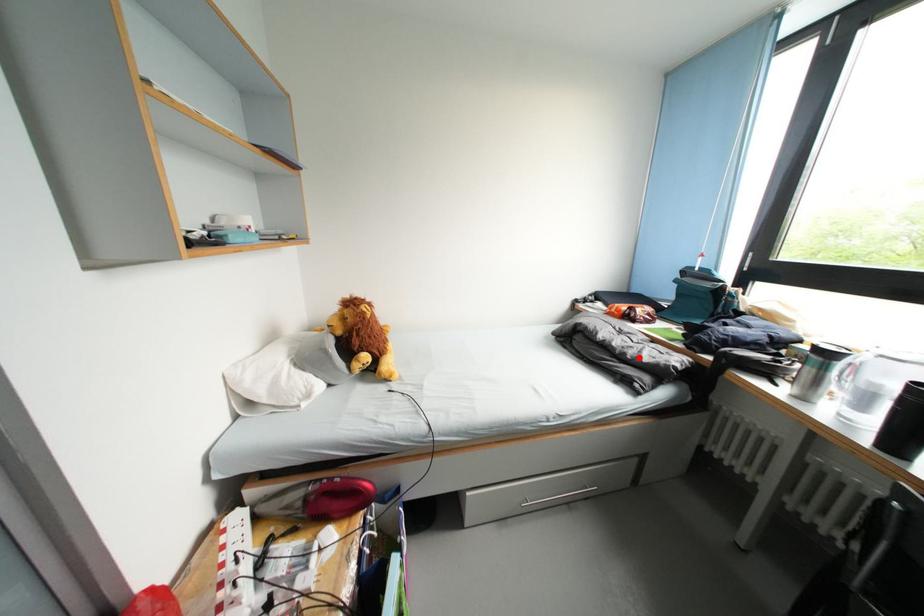
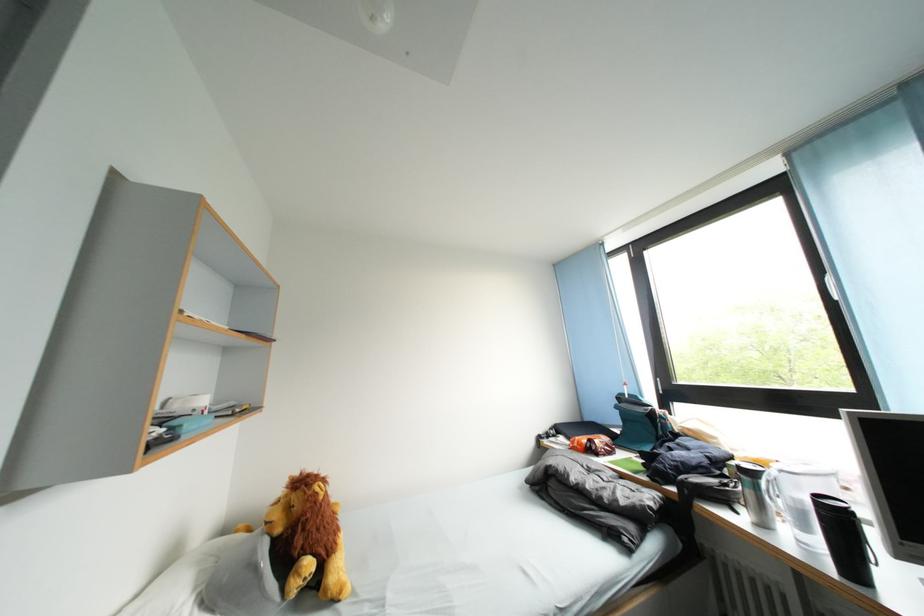
Where in the second image is the point corresponding to the highlighted location from the first image?

(614, 501)